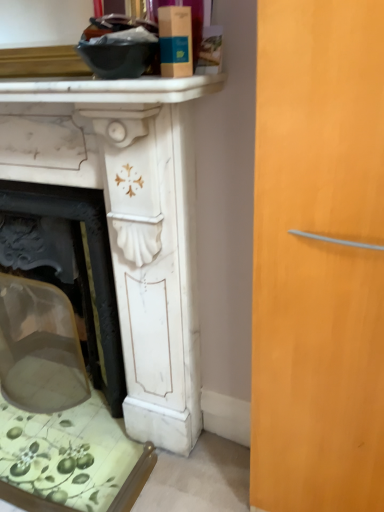
What do you see at coordinates (110, 90) in the screenshot?
I see `white marble fireplace mantel at upper center` at bounding box center [110, 90].

I want to click on white marble fireplace mantel at upper center, so click(110, 90).

The image size is (384, 512). What do you see at coordinates (137, 231) in the screenshot? I see `white marble fireplace at left` at bounding box center [137, 231].

Identify the location of white marble fireplace at left. (137, 231).

In order to click on white marble fireplace mantel at upper center in this screenshot , I will do `click(110, 90)`.

Based on their positions, is white marble fireplace mantel at upper center located to the left or right of white marble fireplace at left?

white marble fireplace mantel at upper center is positioned on white marble fireplace at left's right side.

Is the depth of white marble fireplace mantel at upper center greater than that of white marble fireplace at left?

No, white marble fireplace mantel at upper center is closer to the viewer.

Is point (199, 80) closer to viewer compared to point (82, 163)?

Yes, point (199, 80) is closer to viewer.

From the image's perspective, relative to white marble fireplace at left, is white marble fireplace mantel at upper center above or below?

white marble fireplace mantel at upper center is situated higher than white marble fireplace at left in the image.

From a real-world perspective, is white marble fireplace mantel at upper center below white marble fireplace at left?

No, from a real-world perspective, white marble fireplace mantel at upper center is not beneath white marble fireplace at left.

Can you confirm if white marble fireplace mantel at upper center is wider than white marble fireplace at left?

No.

Considering the sizes of objects white marble fireplace mantel at upper center and white marble fireplace at left in the image provided, who is taller, white marble fireplace mantel at upper center or white marble fireplace at left?

With more height is white marble fireplace at left.

Looking at this image, considering the sizes of objects white marble fireplace mantel at upper center and white marble fireplace at left in the image provided, who is smaller, white marble fireplace mantel at upper center or white marble fireplace at left?

Smaller between the two is white marble fireplace mantel at upper center.

Choose the correct answer: Is white marble fireplace mantel at upper center inside white marble fireplace at left or outside it?

white marble fireplace mantel at upper center is located beyond the bounds of white marble fireplace at left.

Are white marble fireplace mantel at upper center and white marble fireplace at left far apart?

white marble fireplace mantel at upper center is near white marble fireplace at left, not far away.

Is white marble fireplace mantel at upper center positioned with its back to white marble fireplace at left?

white marble fireplace mantel at upper center is not turned away from white marble fireplace at left.

How many degrees apart are the facing directions of white marble fireplace mantel at upper center and white marble fireplace at left?

The facing directions of white marble fireplace mantel at upper center and white marble fireplace at left are 0.0005 degrees apart.

Where is `counter top on the right of white marble fireplace at left`? Image resolution: width=384 pixels, height=512 pixels. counter top on the right of white marble fireplace at left is located at coordinates (110, 90).

Is white marble fireplace at left at the right side of white marble fireplace mantel at upper center?

Incorrect, white marble fireplace at left is not on the right side of white marble fireplace mantel at upper center.

Is white marble fireplace at left in front of or behind white marble fireplace mantel at upper center in the image?

Clearly, white marble fireplace at left is behind white marble fireplace mantel at upper center.

Considering the positions of point (126, 163) and point (39, 100), is point (126, 163) closer or farther from the camera than point (39, 100)?

Point (126, 163) is positioned farther from the camera compared to point (39, 100).

From the image's perspective, which one is positioned higher, white marble fireplace at left or white marble fireplace mantel at upper center?

From the image's view, white marble fireplace mantel at upper center is above.

From a real-world perspective, which is physically below, white marble fireplace at left or white marble fireplace mantel at upper center?

white marble fireplace at left is physically lower.

Is white marble fireplace at left wider or thinner than white marble fireplace mantel at upper center?

Considering their sizes, white marble fireplace at left looks broader than white marble fireplace mantel at upper center.

Looking at this image, is white marble fireplace at left taller than white marble fireplace mantel at upper center?

Yes.

Considering the sizes of objects white marble fireplace at left and white marble fireplace mantel at upper center in the image provided, who is smaller, white marble fireplace at left or white marble fireplace mantel at upper center?

Smaller between the two is white marble fireplace mantel at upper center.

Do you think white marble fireplace at left is within white marble fireplace mantel at upper center, or outside of it?

white marble fireplace at left is not inside white marble fireplace mantel at upper center, it's outside.

Based on the photo, are white marble fireplace at left and white marble fireplace mantel at upper center located far from each other?

No, white marble fireplace at left is not far away from white marble fireplace mantel at upper center.

Could you tell me if white marble fireplace at left is turned towards white marble fireplace mantel at upper center?

No, white marble fireplace at left is not facing towards white marble fireplace mantel at upper center.

At what (x,y) coordinates should I click in order to perform the action: click on table below the white marble fireplace mantel at upper center (from the image's perspective). Please return your answer as a coordinate pair (x, y). This screenshot has height=512, width=384. Looking at the image, I should click on (137, 231).

Find the location of a particular element. counter top in front of the white marble fireplace at left is located at coordinates (110, 90).

Image resolution: width=384 pixels, height=512 pixels. Identify the location of table that is below the white marble fireplace mantel at upper center (from the image's perspective). (137, 231).